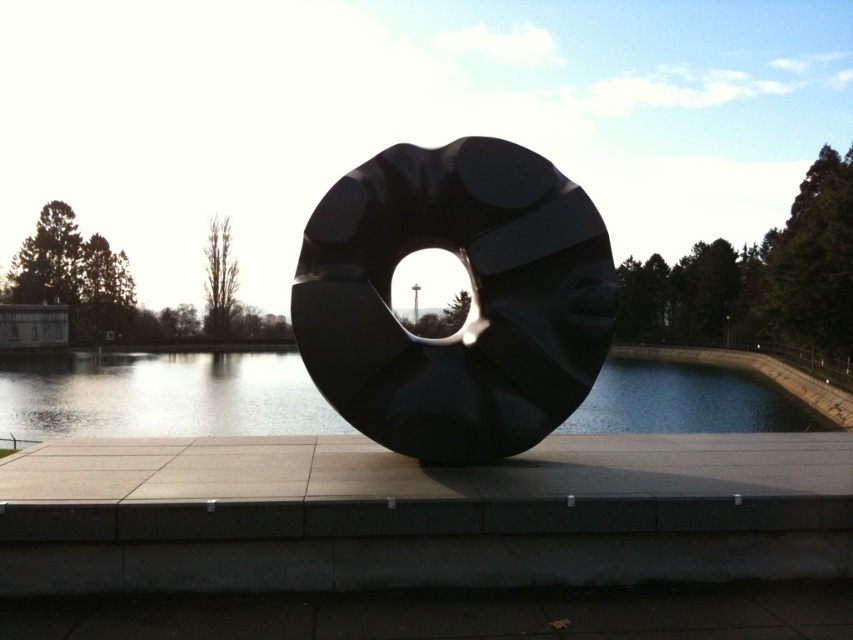
You are standing in front of the sculpture and notice two points marked on its surface. The first is at point location (427, 352) and the second at point location (144, 401). Which of these two points is nearer to your current position?

Point (427, 352) is closer to the viewer than point (144, 401).

You are standing on the paved platform in front of the large black circular sculpture. There is a specific point marked at coordinates (x=473, y=298). Can you tell me what object this point is located on?

The point at coordinates (x=473, y=298) is located on the glossy black donut at center.

You are standing in front of the sculpture and want to take a photo that includes both the glossy black donut at center and the transparent glass water at center. Which object should you position to your left side in the frame?

The glossy black donut at center is to the right of transparent glass water at center, so to include both in your photo, position the transparent glass water at center to your left side and the glossy black donut at center to your right side.